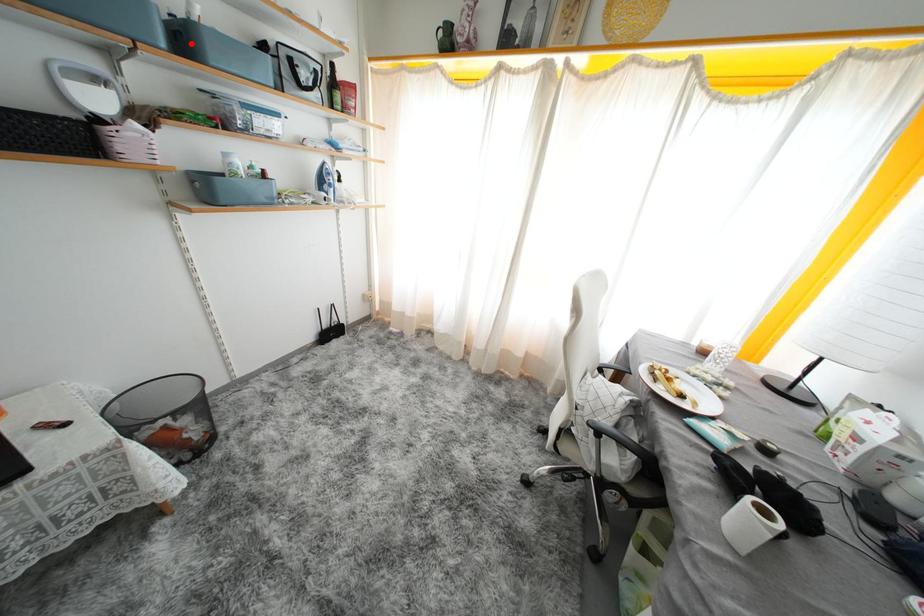
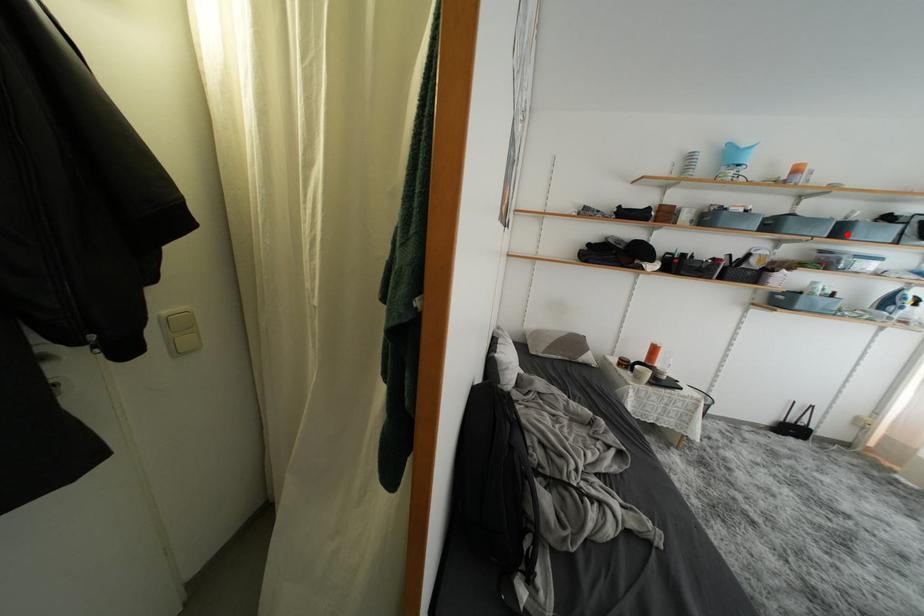
I am providing you with two images of the same scene from different viewpoints. A red point is marked on the first image and another point is marked on the second image. Is the marked point in image1 the same physical position as the marked point in image2?

Yes